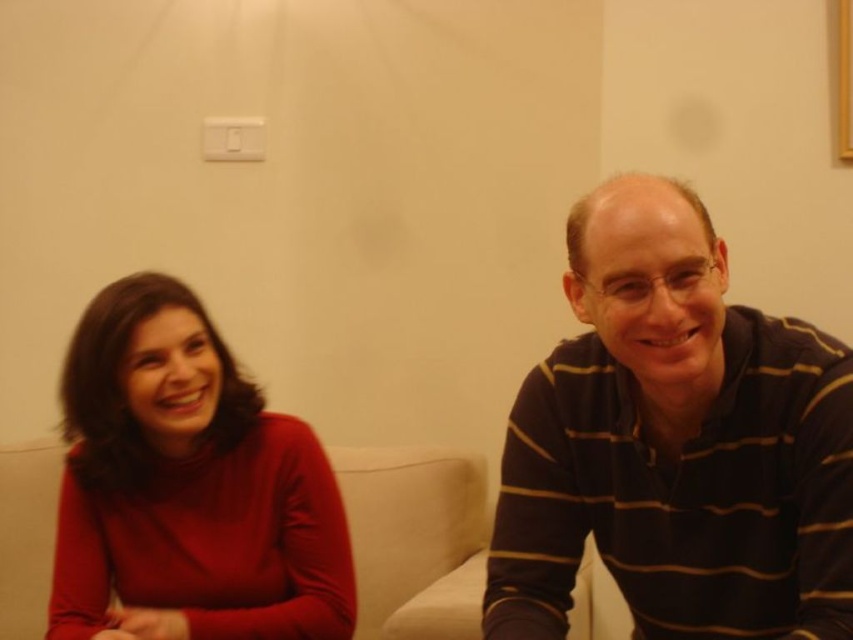
You are a photographer setting up a shoot in this scene. You need to position a small lamp between the matte red sweater at left and the white fabric couch at center. Since the lamp is 1 meter tall, will it fit vertically between them?

The matte red sweater at left is taller than the white fabric couch at center. The lamp is 1 meter tall, so it may not fit vertically between them if the height difference between the sweater and couch is significant. However, without specific measurements, it is difficult to determine definitively.

You are standing in the room where the two people are sitting. You want to place a small gift between them so that it is closer to the person on the right. Which point should you choose, point (155, 545) or point (409, 500)?

You should choose point (155, 545) because it is in front of point (409, 500), making it closer to the person on the right.

You are standing in front of a photo of two people sitting on a beige sofa against a plain wall. The woman on the left wears a red top, and the man on the right has a dark blue striped sweater. There is a point marked at coordinate (x=675, y=444) in the image. Which object does this point correspond to?

The point at coordinate (x=675, y=444) corresponds to the black striped shirt at right.